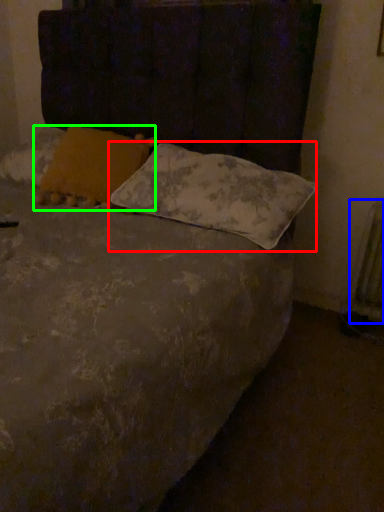
Question: Based on their relative distances, which object is farther from pillow (highlighted by a red box)? Choose from radiator (highlighted by a blue box) and pillow (highlighted by a green box).

Choices:
 (A) radiator
 (B) pillow

Answer: (A)